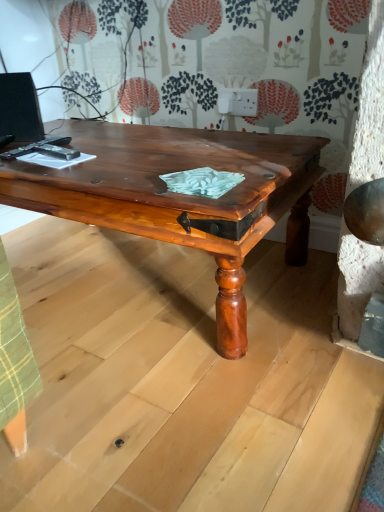
What is the approximate width of shiny brown wood coffee table at center?

shiny brown wood coffee table at center is 61.40 centimeters in width.

The height and width of the screenshot is (512, 384). What do you see at coordinates (181, 196) in the screenshot? I see `shiny brown wood coffee table at center` at bounding box center [181, 196].

This screenshot has width=384, height=512. Identify the location of shiny brown wood coffee table at center. (181, 196).

In order to face matte black monitor at upper left, should I rotate leftwards or rightwards?

It's best to rotate left around 22.792 degrees.

You are a GUI agent. You are given a task and a screenshot of the screen. Output one action in this format:
    pyautogui.click(x=<x>, y=<y>)
    Task: Click on the matte black monitor at upper left
    This screenshot has width=384, height=512.
    Given the screenshot: What is the action you would take?
    pyautogui.click(x=20, y=108)

What do you see at coordinates (20, 108) in the screenshot? I see `matte black monitor at upper left` at bounding box center [20, 108].

Identify the location of shiny brown wood coffee table at center. This screenshot has width=384, height=512. (181, 196).

Does matte black monitor at upper left appear on the left side of shiny brown wood coffee table at center?

Yes, matte black monitor at upper left is to the left of shiny brown wood coffee table at center.

Considering the relative positions of matte black monitor at upper left and shiny brown wood coffee table at center in the image provided, is matte black monitor at upper left in front of shiny brown wood coffee table at center?

No, it is not.

Which is more distant, (x=23, y=74) or (x=175, y=240)?

The point (x=23, y=74) is farther.

From the image's perspective, which object appears higher, matte black monitor at upper left or shiny brown wood coffee table at center?

From the image's view, matte black monitor at upper left is above.

From a real-world perspective, does matte black monitor at upper left stand above shiny brown wood coffee table at center?

Yes, from a real-world perspective, matte black monitor at upper left is over shiny brown wood coffee table at center

Does matte black monitor at upper left have a greater width compared to shiny brown wood coffee table at center?

Incorrect, the width of matte black monitor at upper left does not surpass that of shiny brown wood coffee table at center.

Considering the relative sizes of matte black monitor at upper left and shiny brown wood coffee table at center in the image provided, is matte black monitor at upper left shorter than shiny brown wood coffee table at center?

Indeed, matte black monitor at upper left has a lesser height compared to shiny brown wood coffee table at center.

Does matte black monitor at upper left have a larger size compared to shiny brown wood coffee table at center?

Actually, matte black monitor at upper left might be smaller than shiny brown wood coffee table at center.

Would you say matte black monitor at upper left is inside or outside shiny brown wood coffee table at center?

matte black monitor at upper left is spatially situated outside shiny brown wood coffee table at center.

Is matte black monitor at upper left not close to shiny brown wood coffee table at center?

No, matte black monitor at upper left is not far from shiny brown wood coffee table at center.

Is matte black monitor at upper left aimed at shiny brown wood coffee table at center?

No, matte black monitor at upper left is not turned towards shiny brown wood coffee table at center.

How many degrees apart are the facing directions of matte black monitor at upper left and shiny brown wood coffee table at center?

There is a 19.7-degree angle between the facing directions of matte black monitor at upper left and shiny brown wood coffee table at center.

From the picture: How far apart are matte black monitor at upper left and shiny brown wood coffee table at center?

The distance of matte black monitor at upper left from shiny brown wood coffee table at center is 51.20 centimeters.

Image resolution: width=384 pixels, height=512 pixels. What are the coordinates of `computer monitor above the shiny brown wood coffee table at center (from the image's perspective)` in the screenshot? It's located at (20, 108).

Considering the relative positions of shiny brown wood coffee table at center and matte black monitor at upper left in the image provided, is shiny brown wood coffee table at center to the right of matte black monitor at upper left from the viewer's perspective?

Correct, you'll find shiny brown wood coffee table at center to the right of matte black monitor at upper left.

Which object is further away from the camera, shiny brown wood coffee table at center or matte black monitor at upper left?

matte black monitor at upper left is further away from the camera.

Between point (156, 158) and point (30, 88), which one is positioned behind?

The point (30, 88) is behind.

From the image's perspective, is shiny brown wood coffee table at center under matte black monitor at upper left?

Indeed, from the image's perspective, shiny brown wood coffee table at center is shown beneath matte black monitor at upper left.

From a real-world perspective, is shiny brown wood coffee table at center positioned under matte black monitor at upper left based on gravity?

Yes.

Is shiny brown wood coffee table at center wider than matte black monitor at upper left?

Correct, the width of shiny brown wood coffee table at center exceeds that of matte black monitor at upper left.

Is shiny brown wood coffee table at center shorter than matte black monitor at upper left?

No.

Between shiny brown wood coffee table at center and matte black monitor at upper left, which one has smaller size?

matte black monitor at upper left.

Is shiny brown wood coffee table at center outside of matte black monitor at upper left?

shiny brown wood coffee table at center is positioned outside matte black monitor at upper left.

Is shiny brown wood coffee table at center directly adjacent to matte black monitor at upper left?

They are not placed beside each other.

Is shiny brown wood coffee table at center oriented away from matte black monitor at upper left?

No, shiny brown wood coffee table at center's orientation is not away from matte black monitor at upper left.

Measure the distance from shiny brown wood coffee table at center to matte black monitor at upper left.

shiny brown wood coffee table at center is 51.20 centimeters from matte black monitor at upper left.

At what (x,y) coordinates should I click in order to perform the action: click on coffee table that is below the matte black monitor at upper left (from the image's perspective). Please return your answer as a coordinate pair (x, y). This screenshot has width=384, height=512. Looking at the image, I should click on (181, 196).

Where is `computer monitor above the shiny brown wood coffee table at center (from a real-world perspective)`? computer monitor above the shiny brown wood coffee table at center (from a real-world perspective) is located at coordinates (20, 108).

I want to click on computer monitor above the shiny brown wood coffee table at center (from the image's perspective), so click(20, 108).